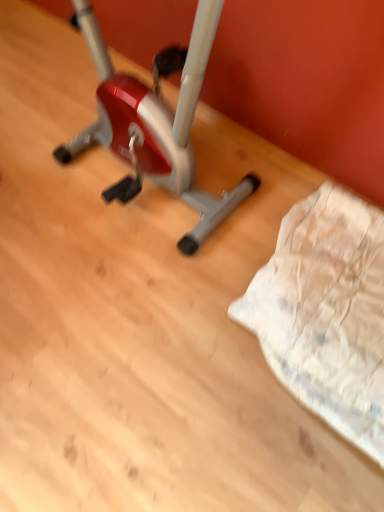
Question: From a real-world perspective, is white textured fabric at lower right under metallic silver stationary bicycle at center?

Choices:
 (A) yes
 (B) no

Answer: (A)

Question: Is white textured fabric at lower right to the left of metallic silver stationary bicycle at center from the viewer's perspective?

Choices:
 (A) no
 (B) yes

Answer: (A)

Question: Considering the relative sizes of white textured fabric at lower right and metallic silver stationary bicycle at center in the image provided, is white textured fabric at lower right taller than metallic silver stationary bicycle at center?

Choices:
 (A) yes
 (B) no

Answer: (B)

Question: Is white textured fabric at lower right positioned before metallic silver stationary bicycle at center?

Choices:
 (A) yes
 (B) no

Answer: (B)

Question: Is white textured fabric at lower right wider than metallic silver stationary bicycle at center?

Choices:
 (A) no
 (B) yes

Answer: (B)

Question: Considering the relative sizes of white textured fabric at lower right and metallic silver stationary bicycle at center in the image provided, is white textured fabric at lower right bigger than metallic silver stationary bicycle at center?

Choices:
 (A) no
 (B) yes

Answer: (A)

Question: From a real-world perspective, is metallic silver stationary bicycle at center on top of white textured fabric at lower right?

Choices:
 (A) no
 (B) yes

Answer: (B)

Question: Is metallic silver stationary bicycle at center outside of white textured fabric at lower right?

Choices:
 (A) no
 (B) yes

Answer: (B)

Question: Does metallic silver stationary bicycle at center turn towards white textured fabric at lower right?

Choices:
 (A) yes
 (B) no

Answer: (B)

Question: Is metallic silver stationary bicycle at center taller than white textured fabric at lower right?

Choices:
 (A) no
 (B) yes

Answer: (B)

Question: Considering the relative sizes of metallic silver stationary bicycle at center and white textured fabric at lower right in the image provided, is metallic silver stationary bicycle at center smaller than white textured fabric at lower right?

Choices:
 (A) no
 (B) yes

Answer: (A)

Question: Does metallic silver stationary bicycle at center have a greater width compared to white textured fabric at lower right?

Choices:
 (A) yes
 (B) no

Answer: (B)

Question: In the image, is metallic silver stationary bicycle at center positioned in front of or behind white textured fabric at lower right?

Choices:
 (A) front
 (B) behind

Answer: (A)